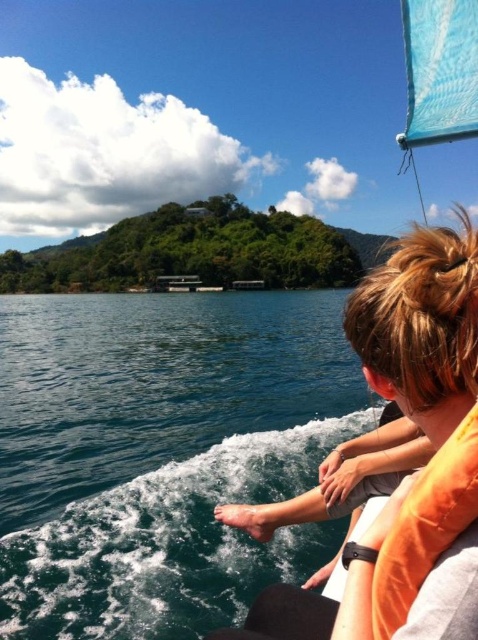
You are a photographer trying to capture the entire scene of the deep blue water at lower left and the orange fabric life jacket at lower right in one shot. Given that your camera has a fixed focal length, which object should you focus on to ensure both are in frame without cropping?

Since the deep blue water at lower left is larger in size compared to the orange fabric life jacket at lower right, you should focus on the deep blue water at lower left to ensure both objects are fully captured in the frame.